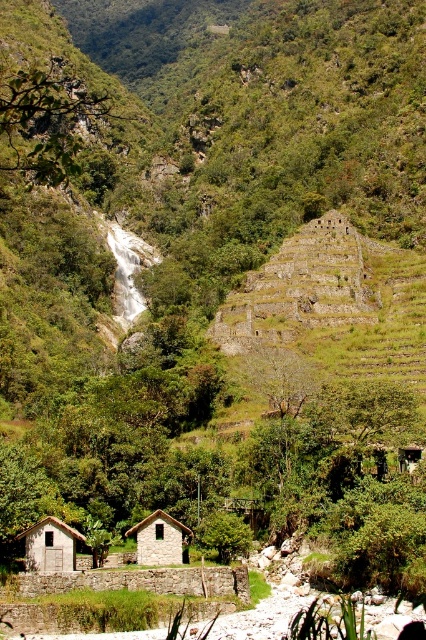
You are a hiker who has just arrived at this valley. You see the gray stone hut at lower left and the stone textured hut at center. Which one is positioned higher up in the valley?

The gray stone hut at lower left is positioned higher up in the valley than the stone textured hut at center.